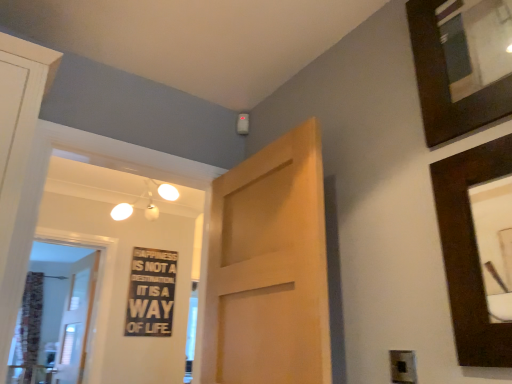
Question: Is dark wood picture frame at upper right, which is the second picture frame from bottom to top, located within light brown wood door at center, which is the 2th door from left to right?

Choices:
 (A) no
 (B) yes

Answer: (A)

Question: Is light brown wood door at center, arranged as the first door when viewed from the front, turned away from dark wood picture frame at upper right, the first picture frame from the top?

Choices:
 (A) no
 (B) yes

Answer: (A)

Question: Can you confirm if light brown wood door at center, which is the 2th door from left to right, is positioned to the right of dark wood picture frame at upper right, which is the second picture frame from bottom to top?

Choices:
 (A) yes
 (B) no

Answer: (B)

Question: Are light brown wood door at center, which is the 2th door from left to right, and dark wood picture frame at upper right, the first picture frame from the top, located far from each other?

Choices:
 (A) no
 (B) yes

Answer: (A)

Question: Is light brown wood door at center, which is the 2th door from left to right, further to the viewer compared to dark wood picture frame at upper right, the first picture frame from the top?

Choices:
 (A) no
 (B) yes

Answer: (B)

Question: Is light brown wood door at center, which is the 2th door from left to right, in front of dark wood picture frame at upper right, which is the second picture frame from bottom to top?

Choices:
 (A) no
 (B) yes

Answer: (A)

Question: Is light brown wood door at center, which is the second door in back-to-front order, not within dark wood picture frame at upper right, the second picture frame positioned from the top?

Choices:
 (A) yes
 (B) no

Answer: (A)

Question: From a real-world perspective, is light brown wood door at center, which is the second door in back-to-front order, below dark wood picture frame at upper right, the 1th picture frame ordered from the bottom?

Choices:
 (A) yes
 (B) no

Answer: (B)

Question: Is light brown wood door at center, which is the 2th door from left to right, with dark wood picture frame at upper right, the 1th picture frame ordered from the bottom?

Choices:
 (A) yes
 (B) no

Answer: (B)

Question: Does light brown wood door at center, the 1th door in the right-to-left sequence, come in front of dark wood picture frame at upper right, the 1th picture frame ordered from the bottom?

Choices:
 (A) no
 (B) yes

Answer: (A)

Question: Considering the relative sizes of light brown wood door at center, arranged as the first door when viewed from the front, and dark wood picture frame at upper right, the second picture frame positioned from the top, in the image provided, is light brown wood door at center, arranged as the first door when viewed from the front, bigger than dark wood picture frame at upper right, the second picture frame positioned from the top,?

Choices:
 (A) no
 (B) yes

Answer: (B)

Question: From the image's perspective, is light brown wood door at center, which is the 2th door from left to right, over dark wood picture frame at upper right, the second picture frame positioned from the top?

Choices:
 (A) yes
 (B) no

Answer: (B)

Question: From the image's perspective, is black plastic electric outlet at lower right located beneath light brown wood door at center, the 1th door in the right-to-left sequence?

Choices:
 (A) no
 (B) yes

Answer: (B)